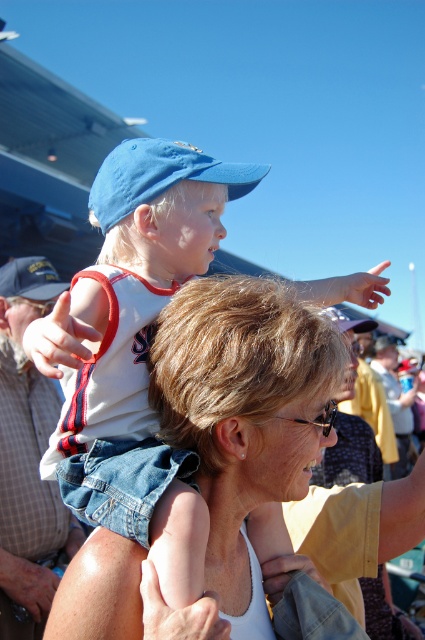
Question: Is the position of matte blue cap at upper left less distant than that of matte blue baseball cap at upper left?

Choices:
 (A) no
 (B) yes

Answer: (B)

Question: Which point is farther to the camera?

Choices:
 (A) (93, 188)
 (B) (22, 273)
 (C) (207, 266)

Answer: (B)

Question: Estimate the real-world distances between objects in this image. Which object is closer to the matte blue cap at upper left?

Choices:
 (A) blue fabric baseball cap at upper center
 (B) matte blue baseball cap at upper left

Answer: (A)

Question: Which object is positioned farthest from the blue fabric baseball cap at upper center?

Choices:
 (A) matte blue baseball cap at upper left
 (B) matte blue cap at upper left

Answer: (A)

Question: Is matte blue cap at upper left closer to the viewer compared to matte blue baseball cap at upper left?

Choices:
 (A) yes
 (B) no

Answer: (A)

Question: Is matte blue cap at upper left thinner than blue fabric baseball cap at upper center?

Choices:
 (A) yes
 (B) no

Answer: (B)